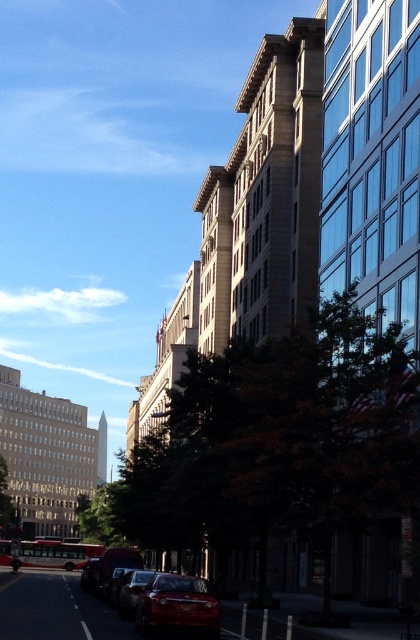
You are a delivery person who needs to park your vehicle between the glossy red car at lower center and the shiny red car at lower left. The space between them is narrow. Can your 3.5 meter long delivery van fit in this space without overlapping either car?

The space between the glossy red car at lower center and the shiny red car at lower left is 28.39 meters, which is significantly wider than the 3.5 meter length of the delivery van. Therefore, the van can comfortably fit in the space without overlapping either car.

In the scene shown: You are standing at the entrance of the modern building on the right. You want to walk to the glossy red car at lower center. Which direction should you walk to reach the car?

Since the glossy red car at lower center is located at point 0.947 on the x axis and 0.424 on the y axis, you should walk towards the lower center direction to reach the car.

You are standing at the point with coordinates point [201,632] and want to walk to the point with coordinates point [92,563]. Which direction should you move relative to the cityscape scene?

You should move backward since point [201,632] is in front of point [92,563], so moving backward will take you towards the desired point.